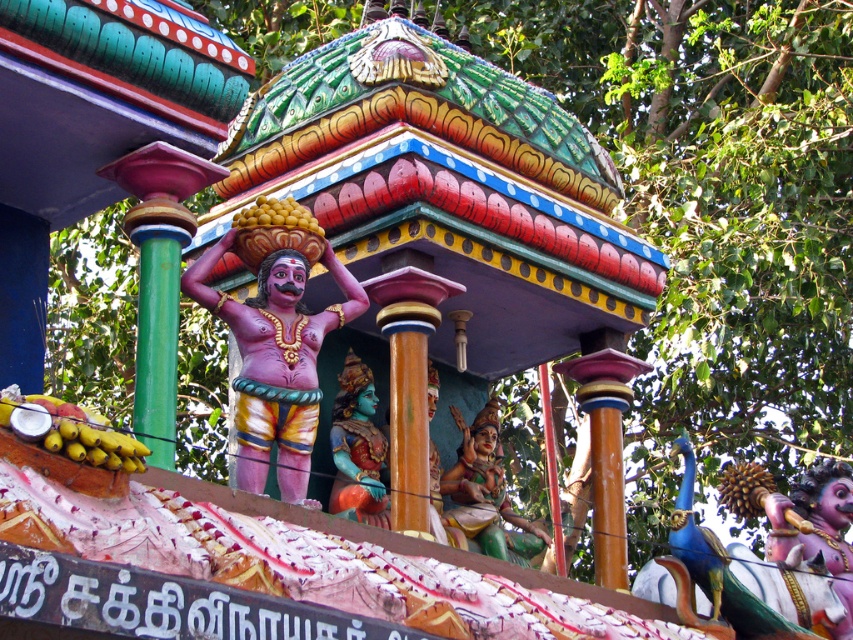
Based on the coordinates provided in the description, where is the pink glossy statue at center located?

The pink glossy statue at center is located at point [276,337].

You are an art student visiting the temple and want to sketch both the green painted statue at center and the teal painted statue at center. Which statue should you focus on first if you want to draw the smaller one first?

The green painted statue at center is smaller than the teal painted statue at center, so you should focus on the green painted statue at center first.

You are standing in front of the temple structure and want to locate the polished pink statue at center. Based on the 2D coordinates provided, in which direction relative to the center of the image should you look to find it?

The polished pink statue at center is located at coordinates point [817,528]. Since the center of the image is at point [426,320], this position is to the right and bottom of the center point. Therefore, you should look to the lower right direction from the center of the image to find the polished pink statue at center.